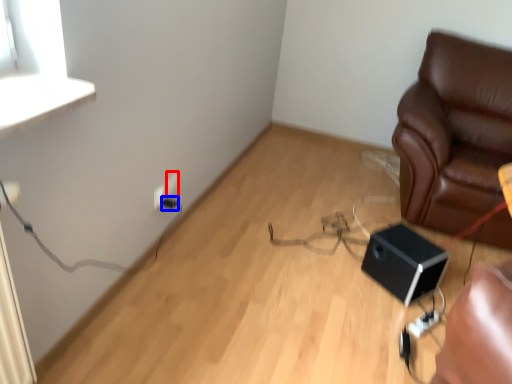
Question: Which of the following is the closest to the observer, electric outlet (highlighted by a red box) or electric outlet (highlighted by a blue box)?

Choices:
 (A) electric outlet
 (B) electric outlet

Answer: (B)